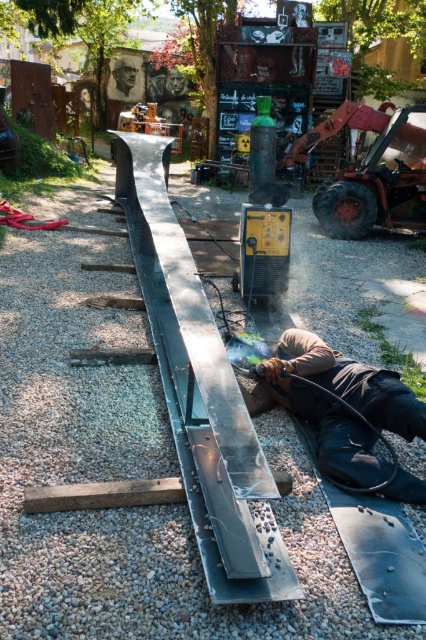
Between dark brown leather jacket at lower center and brown wood plank at lower left, which one is positioned lower?

brown wood plank at lower left is below.

Which is more to the right, dark brown leather jacket at lower center or brown wood plank at lower left?

dark brown leather jacket at lower center

What do you see at coordinates (336, 404) in the screenshot? I see `dark brown leather jacket at lower center` at bounding box center [336, 404].

The height and width of the screenshot is (640, 426). What are the coordinates of `dark brown leather jacket at lower center` in the screenshot? It's located at (336, 404).

Between gray gravel at center and brown wood plank at lower left, which one has more height?

gray gravel at center

Measure the distance from gray gravel at center to brown wood plank at lower left.

gray gravel at center is 29.68 inches from brown wood plank at lower left.

Is point (311, 557) closer to camera compared to point (77, 493)?

Yes, point (311, 557) is in front of point (77, 493).

You are a GUI agent. You are given a task and a screenshot of the screen. Output one action in this format:
    pyautogui.click(x=<x>, y=<y>)
    Task: Click on the gray gravel at center
    Image resolution: width=426 pixels, height=640 pixels.
    Given the screenshot: What is the action you would take?
    pyautogui.click(x=127, y=477)

Between polished steel rail at center and metallic orange forklift at right, which one appears on the left side from the viewer's perspective?

polished steel rail at center

Image resolution: width=426 pixels, height=640 pixels. In order to click on polished steel rail at center in this screenshot , I will do `click(201, 394)`.